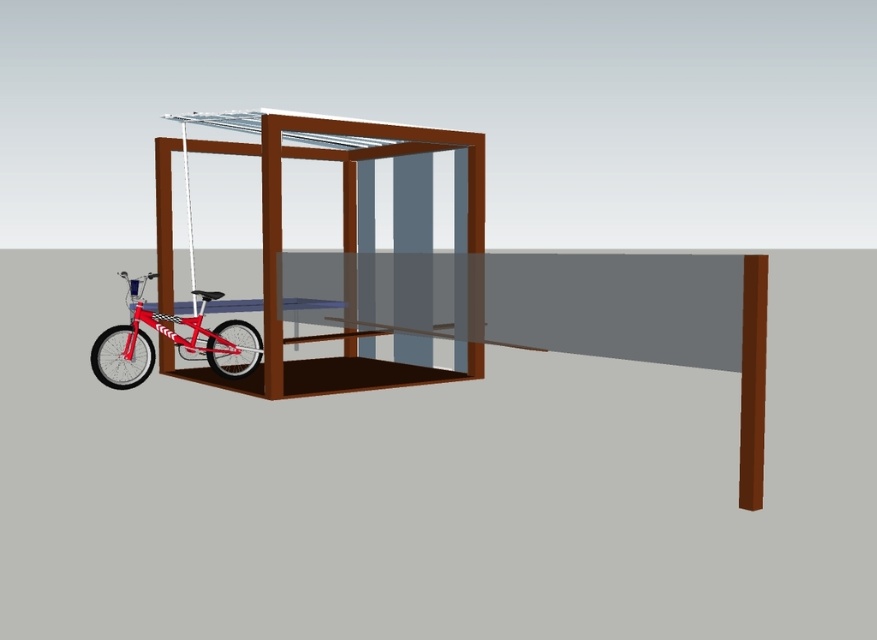
Which of these two, brown matte gazebo at left or shiny red bicycle at left, stands taller?

Standing taller between the two is brown matte gazebo at left.

Who is positioned more to the right, brown matte gazebo at left or shiny red bicycle at left?

brown matte gazebo at left

Does point (457, 172) come in front of point (125, 387)?

No, (457, 172) is further to viewer.

Where is `brown matte gazebo at left`? Image resolution: width=877 pixels, height=640 pixels. brown matte gazebo at left is located at coordinates (347, 234).